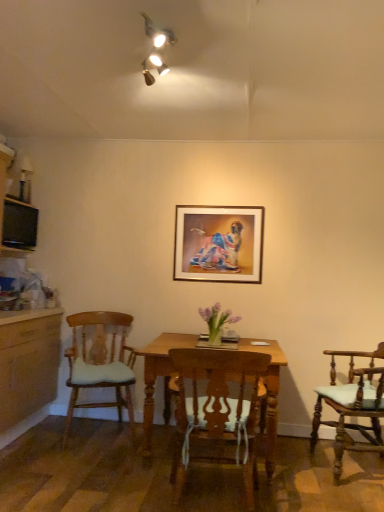
Question: Visually, is wooden chair with cushion at left, arranged as the third chair when viewed from the right, positioned to the left or to the right of wooden chair with cushion at right, acting as the third chair starting from the left?

Choices:
 (A) left
 (B) right

Answer: (A)

Question: From a real-world perspective, is wooden chair with cushion at left, arranged as the third chair when viewed from the right, above or below wooden chair with cushion at right, acting as the third chair starting from the left?

Choices:
 (A) below
 (B) above

Answer: (B)

Question: Which of these objects is positioned closest to the wooden chair with cushion at left, arranged as the third chair when viewed from the right?

Choices:
 (A) black glossy television at left
 (B) wooden chair with cushion at right, which is the 1th chair from right to left
 (C) wooden chair at center, positioned as the second chair in right-to-left order
 (D) gold-framed picture at center

Answer: (C)

Question: Which object is positioned farthest from the wooden chair with cushion at right, acting as the third chair starting from the left?

Choices:
 (A) gold-framed picture at center
 (B) wooden chair with cushion at left, arranged as the third chair when viewed from the right
 (C) black glossy television at left
 (D) wooden chair at center, the second chair from the left

Answer: (C)